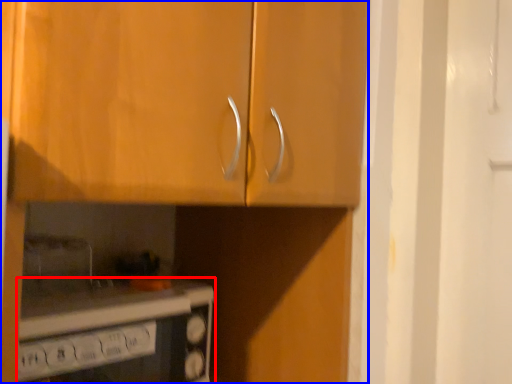
Question: Which of the following is the farthest to the observer, home appliance (highlighted by a red box) or cabinetry (highlighted by a blue box)?

Choices:
 (A) home appliance
 (B) cabinetry

Answer: (A)